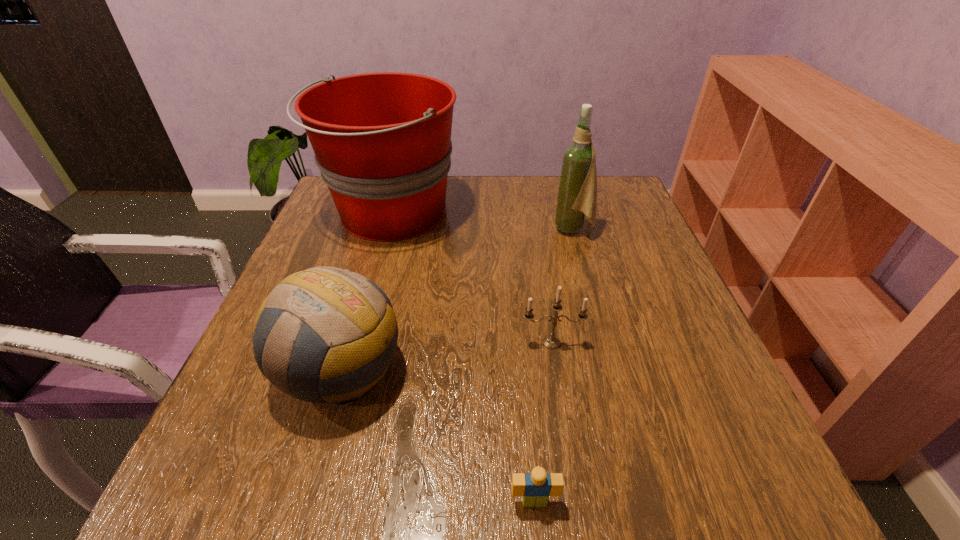
At what (x,y) coordinates should I click in order to perform the action: click on vacant area at the far edge of the desktop. Please return your answer as a coordinate pair (x, y). This screenshot has width=960, height=540. Looking at the image, I should click on (485, 187).

The width and height of the screenshot is (960, 540). I want to click on vacant space at the near edge, so click(609, 463).

In the image, there is a desktop. Where is `blank space at the left edge`? blank space at the left edge is located at coordinates (317, 417).

This screenshot has width=960, height=540. Identify the location of vacant space at the right edge of the desktop. (675, 388).

Find the location of a particular element. vacant point at the near left corner is located at coordinates (205, 496).

I want to click on free region at the far right corner of the desktop, so click(x=610, y=185).

Identify the location of free area in between the Lego and the wine bottle. The height and width of the screenshot is (540, 960). (554, 365).

Find the location of a particular element. vacant space that's between the nearest object and the bucket is located at coordinates (463, 357).

The image size is (960, 540). I want to click on empty space that is in between the shortest object and the wine bottle, so click(554, 365).

You are a GUI agent. You are given a task and a screenshot of the screen. Output one action in this format:
    pyautogui.click(x=<x>, y=<y>)
    Task: Click on the free space that is in between the wine bottle and the bucket
    
    Given the screenshot: What is the action you would take?
    pyautogui.click(x=482, y=221)